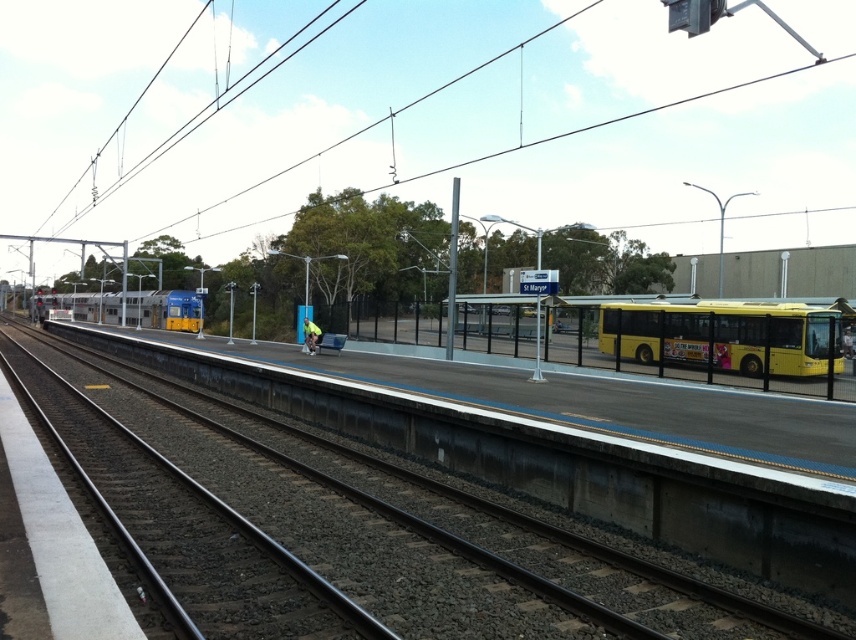
Does point (605, 618) come closer to viewer compared to point (782, 364)?

Yes, it is.

Is metal train track at center shorter than yellow matte bus at right?

Yes, metal train track at center is shorter than yellow matte bus at right.

Is point (395, 618) positioned after point (694, 360)?

No.

Find the location of `metal train track at center`. metal train track at center is located at coordinates (408, 515).

Which of these two, metallic wire at upper center or yellow matte bus at right, stands taller?

With more height is metallic wire at upper center.

From the picture: Does metallic wire at upper center have a greater height compared to yellow matte bus at right?

Correct, metallic wire at upper center is much taller as yellow matte bus at right.

The image size is (856, 640). I want to click on metallic wire at upper center, so click(513, 129).

Where is `metallic wire at upper center`? This screenshot has width=856, height=640. metallic wire at upper center is located at coordinates (513, 129).

Does metallic wire at upper center have a lesser width compared to metal train track at center?

No.

Between metallic wire at upper center and metal train track at center, which one is positioned higher?

metallic wire at upper center is above.

What do you see at coordinates (513, 129) in the screenshot? I see `metallic wire at upper center` at bounding box center [513, 129].

The image size is (856, 640). What are the coordinates of `metallic wire at upper center` in the screenshot? It's located at (513, 129).